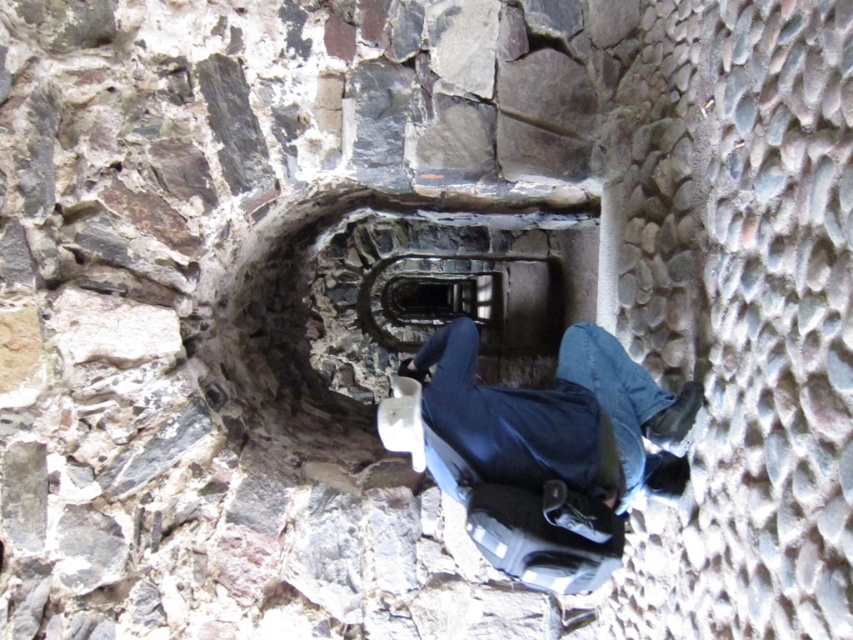
Does blue denim jeans at center come behind metallic spiral staircase at center?

No.

Between point (630, 384) and point (558, 276), which one is positioned in front?

Positioned in front is point (630, 384).

Who is more forward, (577, 472) or (521, 336)?

Point (577, 472)

This screenshot has height=640, width=853. In order to click on blue denim jeans at center in this screenshot , I will do `click(560, 417)`.

Based on the photo, who is higher up, blue denim jeans at center or dark stone staircase at center?

dark stone staircase at center

Does blue denim jeans at center appear over dark stone staircase at center?

No.

Is point (531, 394) closer to camera compared to point (529, 321)?

Yes.

Where is `blue denim jeans at center`? The height and width of the screenshot is (640, 853). blue denim jeans at center is located at coordinates (560, 417).

Which is in front, point (467, 209) or point (511, 320)?

Point (467, 209) is in front.

Is point (258, 339) in front of point (523, 262)?

Yes, point (258, 339) is closer to viewer.

The width and height of the screenshot is (853, 640). What are the coordinates of `dark stone staircase at center` in the screenshot? It's located at (294, 307).